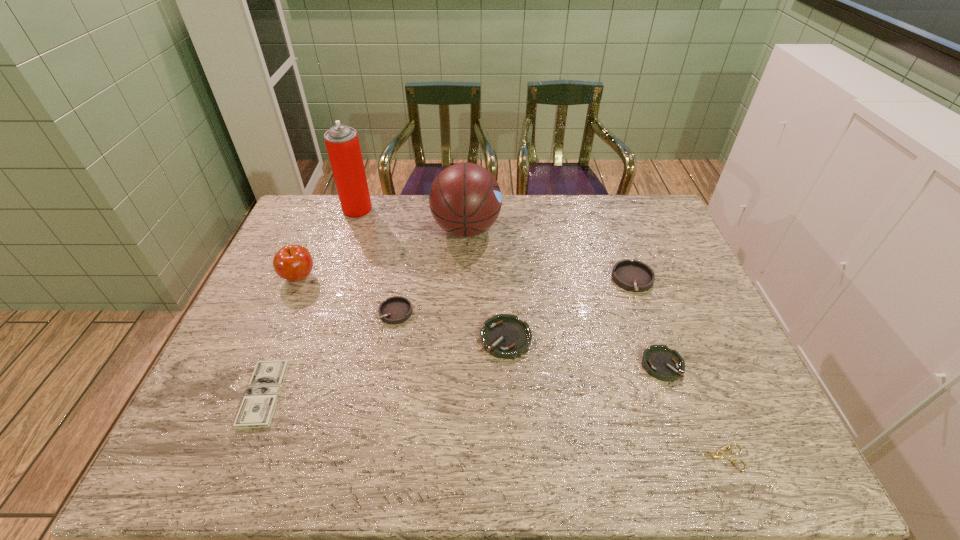
The image size is (960, 540). Find the location of `shears that is at the right edge`. shears that is at the right edge is located at coordinates (718, 455).

At what (x,y) coordinates should I click in order to perform the action: click on object positioned at the far left corner. Please return your answer as a coordinate pair (x, y). The width and height of the screenshot is (960, 540). Looking at the image, I should click on (342, 143).

The width and height of the screenshot is (960, 540). Identify the location of object at the near right corner. (718, 455).

Locate an element on the screen. vacant area at the far edge of the desktop is located at coordinates (554, 204).

At what (x,y) coordinates should I click in order to perform the action: click on vacant space at the left edge of the desktop. Please return your answer as a coordinate pair (x, y). The height and width of the screenshot is (540, 960). Looking at the image, I should click on (217, 431).

Where is `vacant space at the right edge`? Image resolution: width=960 pixels, height=540 pixels. vacant space at the right edge is located at coordinates (686, 295).

The width and height of the screenshot is (960, 540). In the image, there is a desktop. Find the location of `vacant space at the near left corner`. vacant space at the near left corner is located at coordinates (226, 456).

Image resolution: width=960 pixels, height=540 pixels. In order to click on vacant region at the far right corner of the desktop in this screenshot , I will do `click(657, 235)`.

Find the location of a particular element. This screenshot has width=960, height=540. vacant region between the shortest ashtray and the shortest object is located at coordinates (690, 411).

What are the coordinates of `free space between the farther gray ashtray and the third shortest object` in the screenshot? It's located at (648, 322).